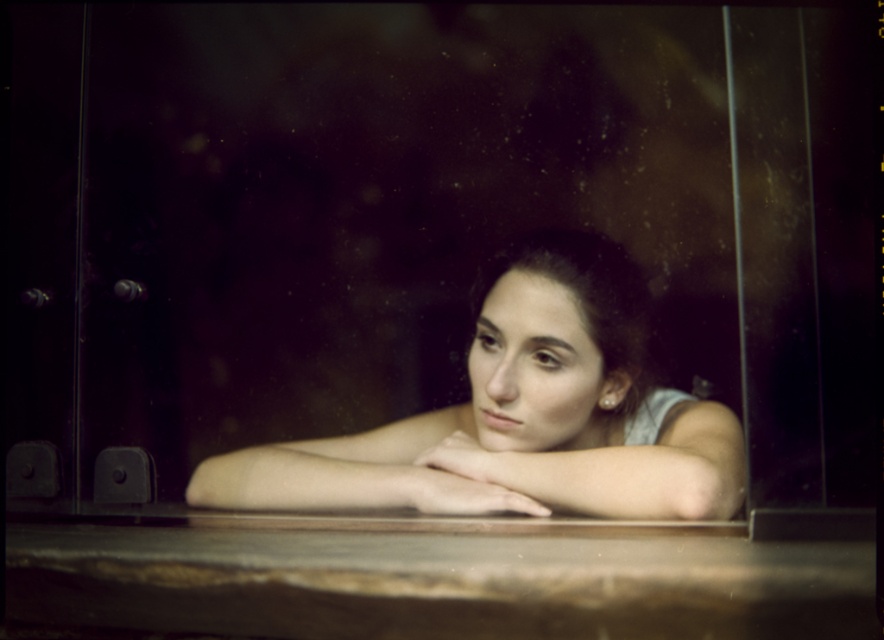
Question: Can you confirm if matte skin girl at center is wider than matte skin arm at center?

Choices:
 (A) no
 (B) yes

Answer: (B)

Question: Among these points, which one is nearest to the camera?

Choices:
 (A) (460, 451)
 (B) (349, 508)

Answer: (B)

Question: Which point is closer to the camera taking this photo?

Choices:
 (A) (273, 468)
 (B) (646, 451)

Answer: (B)

Question: Among these points, which one is farthest from the camera?

Choices:
 (A) (519, 292)
 (B) (619, 451)

Answer: (A)

Question: Does matte skin girl at center have a lesser width compared to matte skin arm at center?

Choices:
 (A) yes
 (B) no

Answer: (B)

Question: Observing the image, what is the correct spatial positioning of matte skin girl at center in reference to matte skin arm at center?

Choices:
 (A) above
 (B) below

Answer: (B)